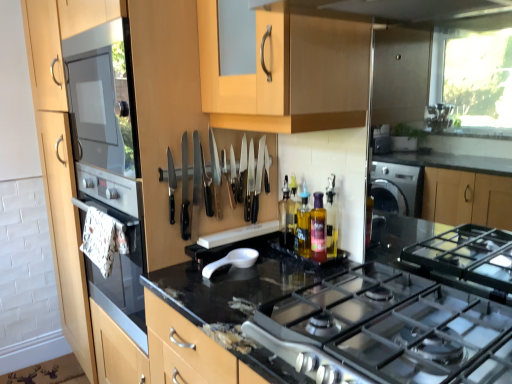
You are a GUI agent. You are given a task and a screenshot of the screen. Output one action in this format:
    pyautogui.click(x=<x>, y=<y>)
    Task: Click on the space that is in front of translucent plastic bottle at center, which is the 3th bottle in front-to-back order
    The width and height of the screenshot is (512, 384).
    Given the screenshot: What is the action you would take?
    pyautogui.click(x=287, y=267)